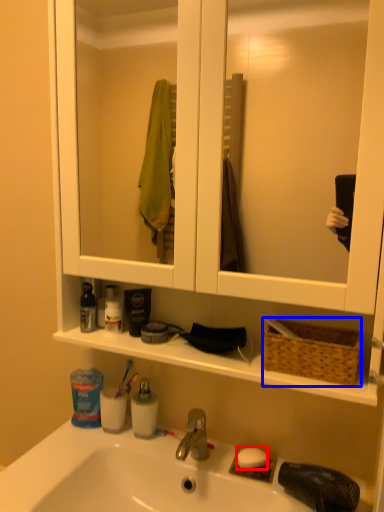
Question: Which point is further to the camera, soap (highlighted by a red box) or picnic basket (highlighted by a blue box)?

Choices:
 (A) soap
 (B) picnic basket

Answer: (A)